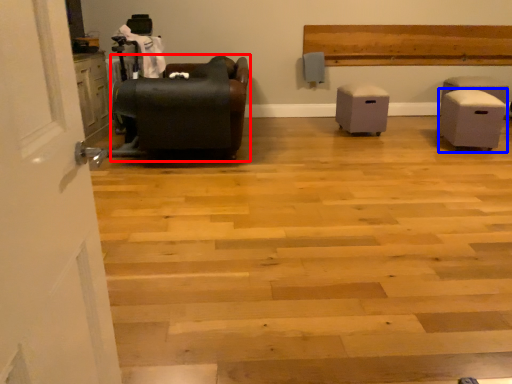
Question: Which of the following is the closest to the observer, furniture (highlighted by a red box) or furniture (highlighted by a blue box)?

Choices:
 (A) furniture
 (B) furniture

Answer: (A)